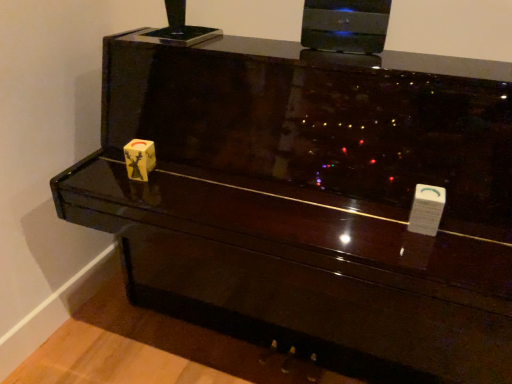
What is the approximate height of black glossy laptop at upper center?

The height of black glossy laptop at upper center is 6.39 inches.

This screenshot has width=512, height=384. In order to click on black glossy laptop at upper center in this screenshot , I will do `click(345, 25)`.

Describe the element at coordinates (345, 25) in the screenshot. I see `black glossy laptop at upper center` at that location.

Identify the location of black glossy laptop at upper center. (345, 25).